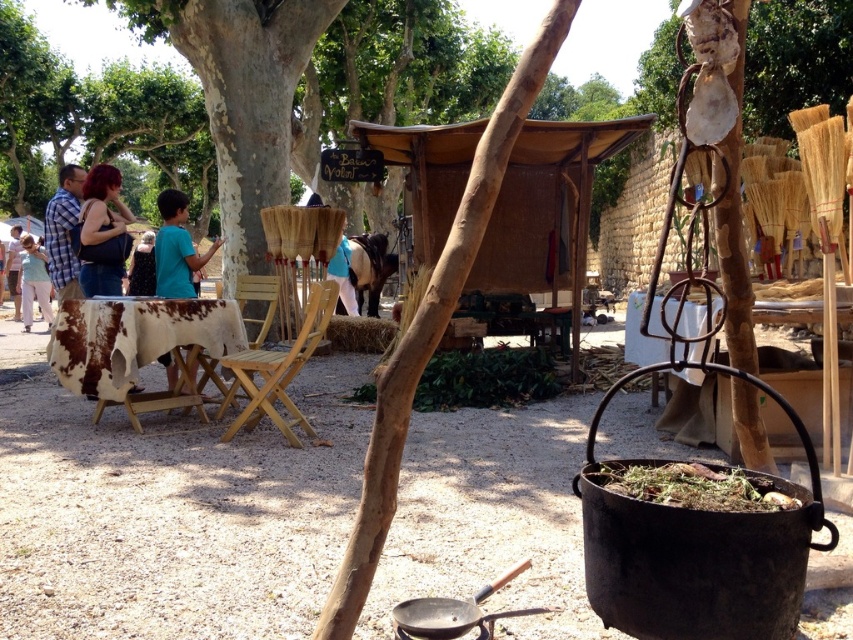
Question: Which is farther from the teal shirt at center?

Choices:
 (A) blue fabric shirt at center
 (B) light wood folding chair at center

Answer: (A)

Question: Which of the following is the closest to the observer?

Choices:
 (A) [x=173, y=10]
 (B) [x=341, y=248]

Answer: (A)

Question: Can you confirm if light blue shirt at left is positioned to the left of blue fabric shirt at center?

Choices:
 (A) yes
 (B) no

Answer: (A)

Question: Can you confirm if matte black tank top at center is wider than light blue shirt at left?

Choices:
 (A) no
 (B) yes

Answer: (A)

Question: Which of these objects is positioned farthest from the wooden chair at center?

Choices:
 (A) light blue shirt at left
 (B) blue fabric shirt at center
 (C) matte black purse at left
 (D) green leafy tree at upper left

Answer: (D)

Question: Does light wood folding chair at center appear on the right side of light blue shirt at center?

Choices:
 (A) no
 (B) yes

Answer: (B)